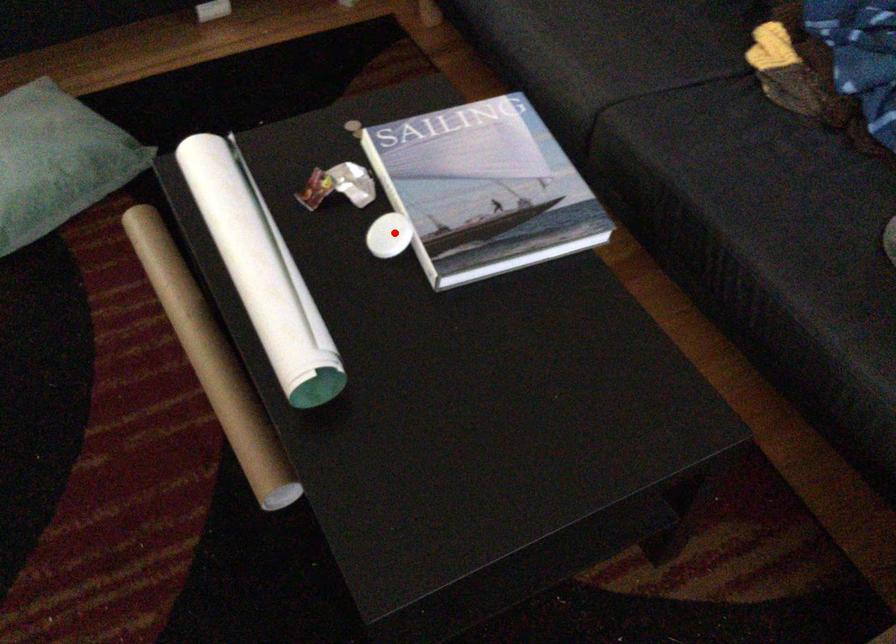
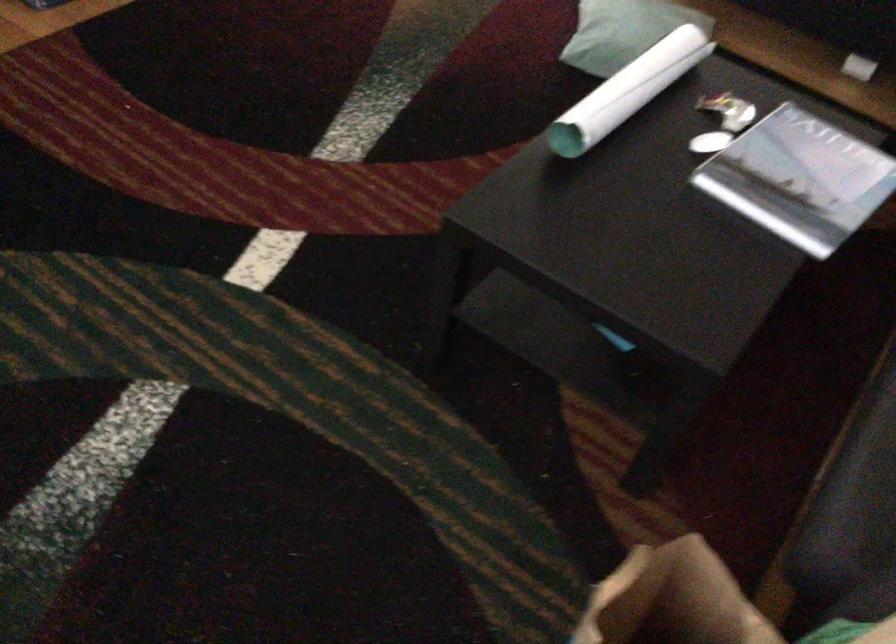
Locate, in the second image, the point that corresponds to the highlighted location in the first image.

(709, 142)